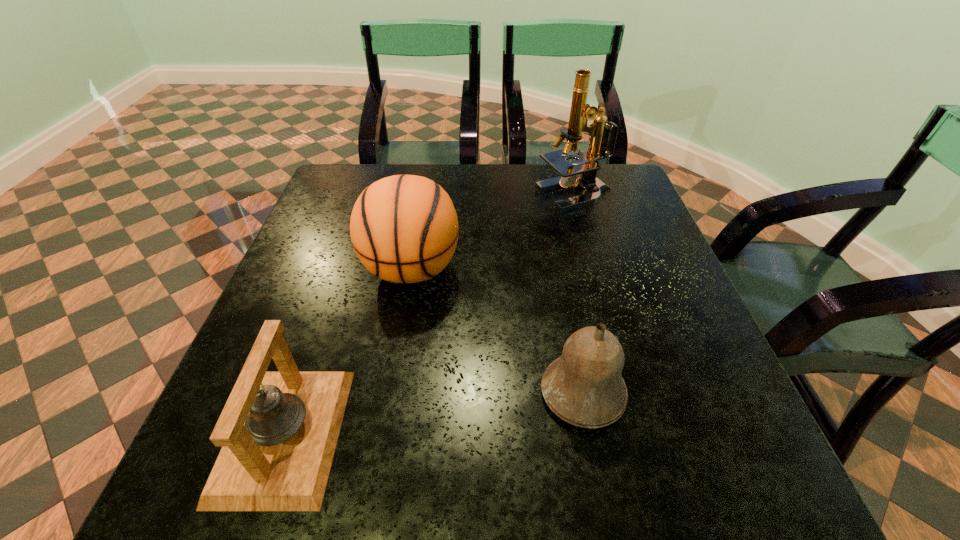
Find the location of a particular element. Image resolution: width=960 pixels, height=540 pixels. blank space at the left edge of the desktop is located at coordinates (344, 306).

In order to click on vacant space at the right edge of the desktop in this screenshot , I will do `click(650, 233)`.

Image resolution: width=960 pixels, height=540 pixels. What are the coordinates of `blank area at the far right corner` in the screenshot? It's located at (638, 206).

Where is `vacant area that lies between the right bell and the left bell`? vacant area that lies between the right bell and the left bell is located at coordinates (434, 413).

Where is `free space between the farthest object and the left bell`? The width and height of the screenshot is (960, 540). free space between the farthest object and the left bell is located at coordinates (430, 315).

Identify the location of vacant point located between the right bell and the left bell. The image size is (960, 540). (434, 413).

Locate an element on the screen. free space between the right bell and the left bell is located at coordinates (434, 413).

At what (x,y) coordinates should I click in order to perform the action: click on empty location between the right bell and the basketball. Please return your answer as a coordinate pair (x, y). Looking at the image, I should click on (497, 331).

Identify the location of vacant area that lies between the basketball and the left bell. The image size is (960, 540). (348, 352).

Locate an element on the screen. The width and height of the screenshot is (960, 540). vacant area between the right bell and the left bell is located at coordinates (434, 413).